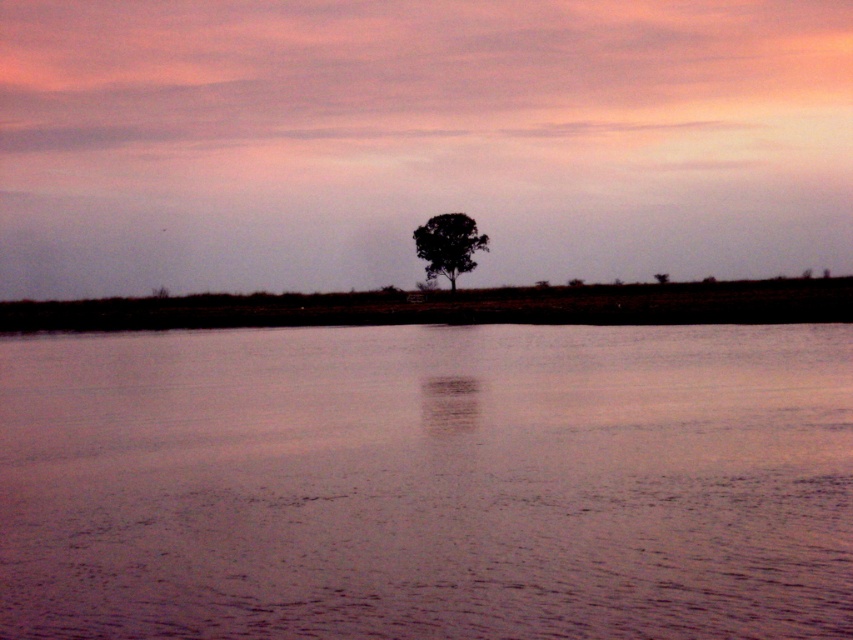
You are an artist trying to paint the scene. You want to place the smooth water at center to the right of the silhouette textured tree at center. Is this possible based on the current arrangement?

The smooth water at center is positioned on the left side of the silhouette textured tree at center, so you cannot place the smooth water at center to the right of the silhouette textured tree at center as it is currently to the left.

You are standing on the shore looking at the smooth water at center and the silhouette textured tree at center. Which object is closer to the horizon?

The smooth water at center is positioned under the silhouette textured tree at center, so the silhouette textured tree at center is closer to the horizon than the smooth water at center.